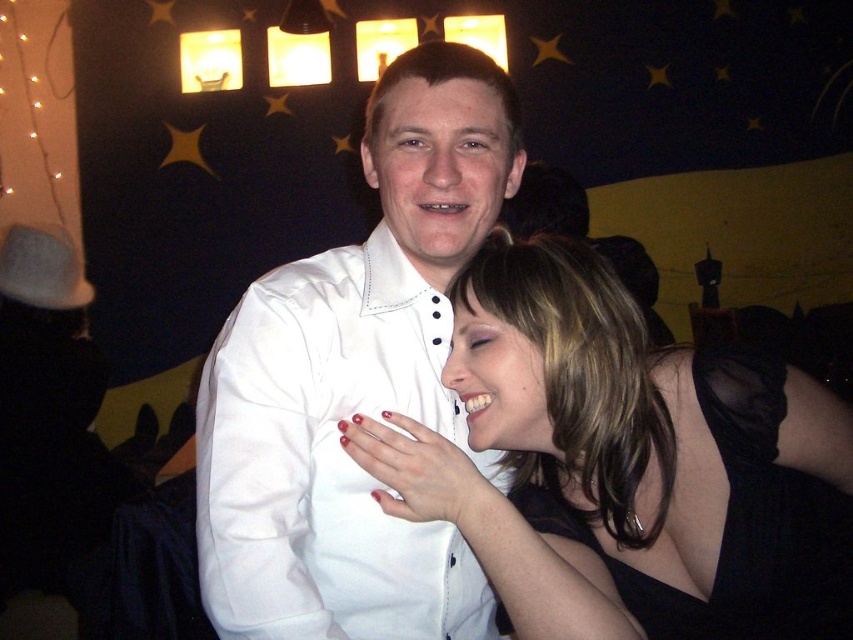
Question: Is satin black dress at center above white satin shirt at center?

Choices:
 (A) no
 (B) yes

Answer: (A)

Question: Does satin black dress at center have a lesser width compared to black satin dress at lower right?

Choices:
 (A) no
 (B) yes

Answer: (A)

Question: Which point is farther from the camera taking this photo?

Choices:
 (A) (397, 248)
 (B) (740, 458)
 (C) (426, 458)

Answer: (A)

Question: Which object is closer to the camera taking this photo?

Choices:
 (A) white satin shirt at center
 (B) satin black dress at center

Answer: (A)

Question: Is satin black dress at center positioned behind black satin dress at lower right?

Choices:
 (A) no
 (B) yes

Answer: (A)

Question: Which point is closer to the camera?

Choices:
 (A) white satin shirt at center
 (B) satin black dress at center
 (C) black satin dress at lower right

Answer: (A)